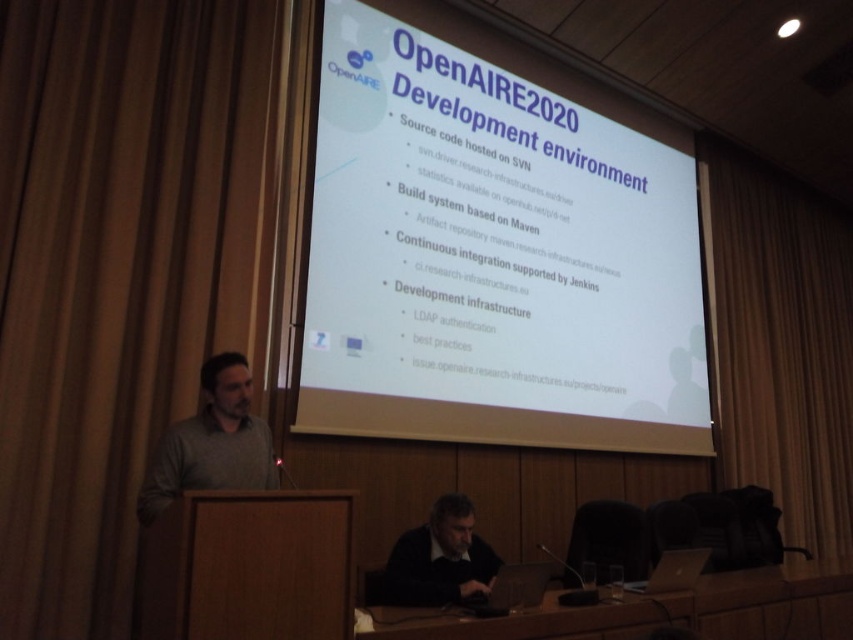
From the picture: You are an attendee at the presentation and want to take a photo of the slide on the screen. However, you notice the brown fabric curtain at right and the dark gray sweater at lower center might block your view. Which object is taller and could potentially block more of the screen?

The brown fabric curtain at right is much taller than the dark gray sweater at lower center, so it could potentially block more of the screen.

You are sitting in the audience of this presentation and notice two items in the scene. One is the brown fabric curtain at right and the other is the dark gray sweater at lower center. Which of these two items is positioned to the right side of the other?

The brown fabric curtain at right is positioned to the right of the dark gray sweater at lower center.